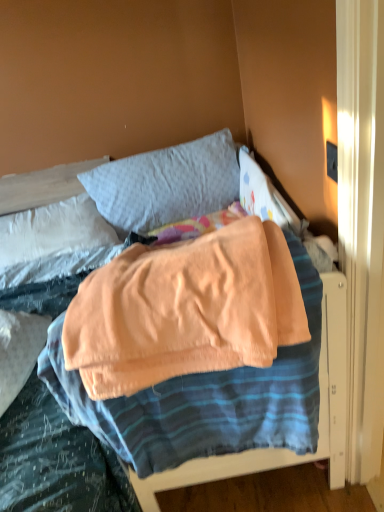
Question: From the image's perspective, is light gray fabric pillow at upper left, the 2th pillow positioned from the right, on top of soft peach blanket at center?

Choices:
 (A) no
 (B) yes

Answer: (B)

Question: Is the position of light gray fabric pillow at upper left, which is the 1th pillow in left-to-right order, more distant than that of soft peach blanket at center?

Choices:
 (A) yes
 (B) no

Answer: (A)

Question: Considering the relative positions of light gray fabric pillow at upper left, which is the 1th pillow in left-to-right order, and soft peach blanket at center in the image provided, is light gray fabric pillow at upper left, which is the 1th pillow in left-to-right order, to the left of soft peach blanket at center from the viewer's perspective?

Choices:
 (A) no
 (B) yes

Answer: (B)

Question: From the image's perspective, is light gray fabric pillow at upper left, the 2th pillow positioned from the right, below soft peach blanket at center?

Choices:
 (A) no
 (B) yes

Answer: (A)

Question: From a real-world perspective, is light gray fabric pillow at upper left, the 2th pillow positioned from the right, beneath soft peach blanket at center?

Choices:
 (A) yes
 (B) no

Answer: (A)

Question: Considering the relative positions of light gray fabric pillow at upper left, which is the 1th pillow in left-to-right order, and soft peach blanket at center in the image provided, is light gray fabric pillow at upper left, which is the 1th pillow in left-to-right order, in front of soft peach blanket at center?

Choices:
 (A) no
 (B) yes

Answer: (A)

Question: Is matte black outlet at upper right facing away from gray cotton pillow at upper center, which is counted as the second pillow, starting from the left?

Choices:
 (A) yes
 (B) no

Answer: (B)

Question: Is matte black outlet at upper right wider than gray cotton pillow at upper center, which is counted as the second pillow, starting from the left?

Choices:
 (A) yes
 (B) no

Answer: (B)

Question: Can you confirm if matte black outlet at upper right is thinner than gray cotton pillow at upper center, which is counted as the second pillow, starting from the left?

Choices:
 (A) no
 (B) yes

Answer: (B)

Question: Does matte black outlet at upper right have a lesser height compared to gray cotton pillow at upper center, which is counted as the first pillow, starting from the right?

Choices:
 (A) no
 (B) yes

Answer: (B)

Question: Does matte black outlet at upper right lie in front of gray cotton pillow at upper center, which is counted as the first pillow, starting from the right?

Choices:
 (A) yes
 (B) no

Answer: (A)

Question: From the image's perspective, would you say matte black outlet at upper right is shown under gray cotton pillow at upper center, which is counted as the first pillow, starting from the right?

Choices:
 (A) no
 (B) yes

Answer: (B)

Question: From a real-world perspective, is gray cotton pillow at upper center, which is counted as the first pillow, starting from the right, located higher than light gray fabric pillow at upper left, the 2th pillow positioned from the right?

Choices:
 (A) no
 (B) yes

Answer: (B)